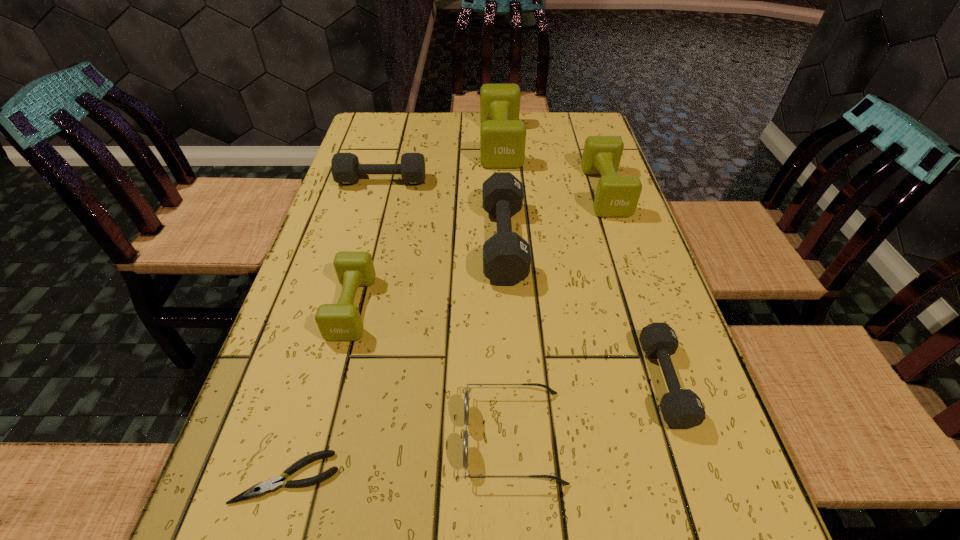
Locate an element on the screen. The width and height of the screenshot is (960, 540). free spot between the nearest olive dumbbell and the second biggest olive dumbbell is located at coordinates (478, 249).

This screenshot has height=540, width=960. What are the coordinates of `empty location between the leftmost gray dumbbell and the nearest gray dumbbell` in the screenshot? It's located at (523, 282).

Identify the location of free space between the nearest gray dumbbell and the sunglasses. (589, 409).

Where is `free space between the shortest object and the nearest gray dumbbell`? free space between the shortest object and the nearest gray dumbbell is located at coordinates (476, 430).

Locate an element on the screen. free space that is in between the rightmost gray dumbbell and the nearest olive dumbbell is located at coordinates (508, 345).

You are a GUI agent. You are given a task and a screenshot of the screen. Output one action in this format:
    pyautogui.click(x=<x>, y=<y>)
    Task: Click on the free space between the smallest gray dumbbell and the pliers
    The height and width of the screenshot is (540, 960).
    Given the screenshot: What is the action you would take?
    pyautogui.click(x=476, y=430)

Identify the location of free space between the nearest olive dumbbell and the rightmost olive dumbbell. This screenshot has height=540, width=960. (478, 249).

The image size is (960, 540). Find the location of `vacant area that lies between the pliers and the second nearest gray dumbbell`. vacant area that lies between the pliers and the second nearest gray dumbbell is located at coordinates (396, 359).

You are a GUI agent. You are given a task and a screenshot of the screen. Output one action in this format:
    pyautogui.click(x=<x>, y=<y>)
    Task: Click on the object that is the sixth nearest to the leftmost olive dumbbell
    
    Given the screenshot: What is the action you would take?
    pyautogui.click(x=681, y=408)

At what (x,y) coordinates should I click in order to perform the action: click on object that stands as the third closest to the rightmost gray dumbbell. Please return your answer as a coordinate pair (x, y). This screenshot has width=960, height=540. Looking at the image, I should click on [x=616, y=195].